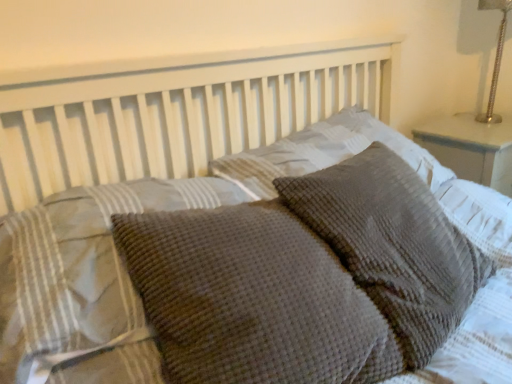
Question: Does waffle-textured gray pillow at center, the third pillow viewed from the left, have a greater height compared to waffle-textured gray pillow at center, which is counted as the 1th pillow, starting from the right?

Choices:
 (A) no
 (B) yes

Answer: (A)

Question: From the image's perspective, would you say waffle-textured gray pillow at center, the third pillow viewed from the left, is shown under waffle-textured gray pillow at center, the fourth pillow viewed from the left?

Choices:
 (A) no
 (B) yes

Answer: (A)

Question: From a real-world perspective, is waffle-textured gray pillow at center, the 2th pillow when ordered from right to left, positioned over waffle-textured gray pillow at center, the fourth pillow viewed from the left, based on gravity?

Choices:
 (A) no
 (B) yes

Answer: (B)

Question: Does waffle-textured gray pillow at center, the 2th pillow when ordered from right to left, contain waffle-textured gray pillow at center, the fourth pillow viewed from the left?

Choices:
 (A) yes
 (B) no

Answer: (B)

Question: From a real-world perspective, is waffle-textured gray pillow at center, the third pillow viewed from the left, located beneath waffle-textured gray pillow at center, which is counted as the 1th pillow, starting from the right?

Choices:
 (A) yes
 (B) no

Answer: (B)

Question: Is waffle-textured gray pillow at center, which is counted as the 1th pillow, starting from the right, to the left or to the right of waffle-textured gray pillow at center, the 2th pillow when ordered from right to left, in the image?

Choices:
 (A) left
 (B) right

Answer: (B)

Question: From the image's perspective, is waffle-textured gray pillow at center, which is counted as the 1th pillow, starting from the right, positioned above or below waffle-textured gray pillow at center, the 2th pillow when ordered from right to left?

Choices:
 (A) below
 (B) above

Answer: (A)

Question: From a real-world perspective, is waffle-textured gray pillow at center, the fourth pillow viewed from the left, physically located above or below waffle-textured gray pillow at center, the 2th pillow when ordered from right to left?

Choices:
 (A) below
 (B) above

Answer: (A)

Question: Is point (461, 288) closer or farther from the camera than point (347, 109)?

Choices:
 (A) closer
 (B) farther

Answer: (A)

Question: Considering the positions of silver metallic lamp at upper right and waffle-textured gray pillow at center, the third pillow viewed from the left, in the image, is silver metallic lamp at upper right wider or thinner than waffle-textured gray pillow at center, the third pillow viewed from the left,?

Choices:
 (A) thin
 (B) wide

Answer: (A)

Question: Considering the positions of silver metallic lamp at upper right and waffle-textured gray pillow at center, the third pillow viewed from the left, in the image, is silver metallic lamp at upper right taller or shorter than waffle-textured gray pillow at center, the third pillow viewed from the left,?

Choices:
 (A) short
 (B) tall

Answer: (B)

Question: Visually, is silver metallic lamp at upper right positioned to the left or to the right of waffle-textured gray pillow at center, the 2th pillow when ordered from right to left?

Choices:
 (A) left
 (B) right

Answer: (B)

Question: Is point (504, 19) closer or farther from the camera than point (428, 152)?

Choices:
 (A) closer
 (B) farther

Answer: (B)

Question: Is point 367,188 positioned closer to the camera than point 11,306?

Choices:
 (A) closer
 (B) farther

Answer: (B)

Question: In the image, is waffle-textured gray pillow at center, the fourth pillow viewed from the left, on the left side or the right side of waffle-textured gray pillow at center, the 1th pillow viewed from the left?

Choices:
 (A) left
 (B) right

Answer: (B)